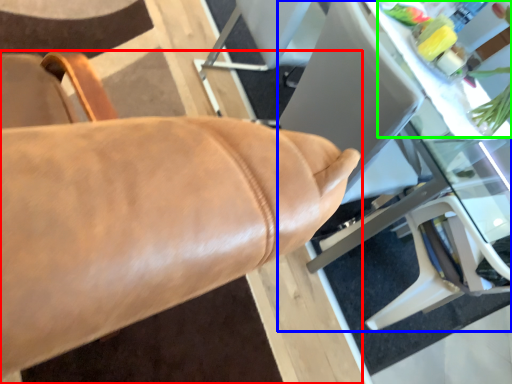
Question: Based on their relative distances, which object is nearer to chair (highlighted by a red box)? Choose from table (highlighted by a blue box) and floral arrangement (highlighted by a green box).

Choices:
 (A) table
 (B) floral arrangement

Answer: (A)